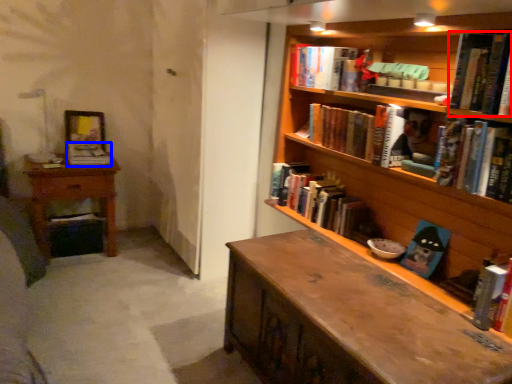
Question: Which object appears closest to the camera in this image, book (highlighted by a red box) or book (highlighted by a blue box)?

Choices:
 (A) book
 (B) book

Answer: (A)